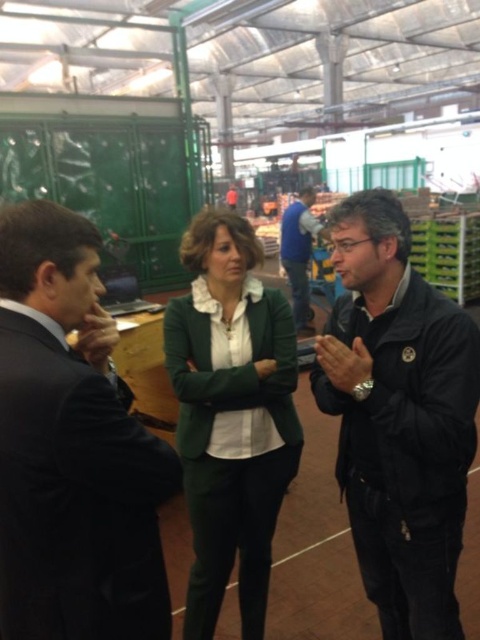
You are a security guard in the warehouse and need to identify the person wearing the smaller clothing item between the black suit at left and the blue denim jeans at center. Which one should you report?

The black suit at left is smaller than the blue denim jeans at center, so you should report the black suit at left as the person wearing the smaller clothing item.

You are a delivery person who needs to place a small box between the black matte jacket at right and the green fabric jacket at center. Can you fit the box if it measures 15 inches in length?

The black matte jacket at right is 16.04 inches away from the green fabric jacket at center, so yes, the box measuring 15 inches in length can fit between them.